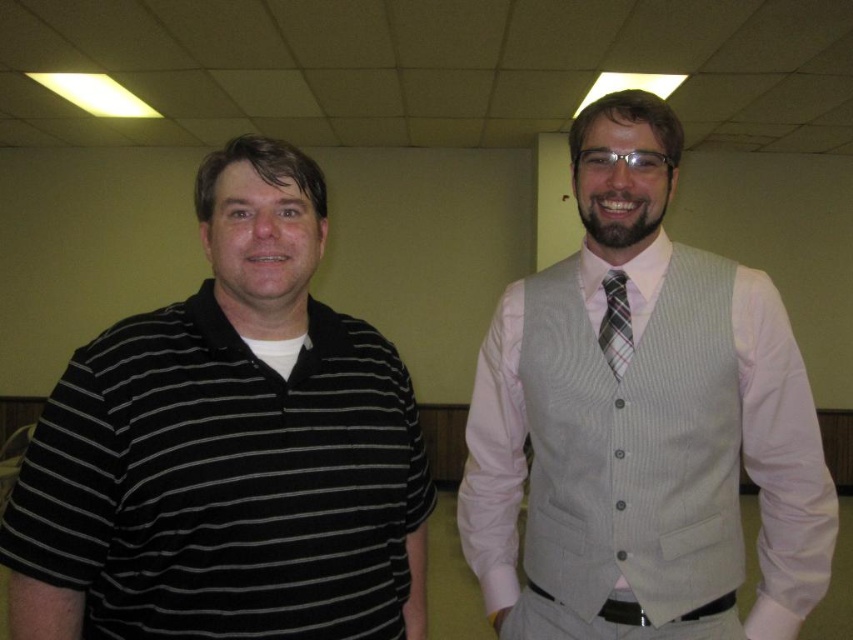
Question: Is light gray textured vest at center bigger than plaid fabric tie at center?

Choices:
 (A) no
 (B) yes

Answer: (B)

Question: Which object is farther from the camera taking this photo?

Choices:
 (A) black striped polo shirt at left
 (B) light gray textured vest at center

Answer: (B)

Question: Which point appears closest to the camera in this image?

Choices:
 (A) (541, 461)
 (B) (605, 308)
 (C) (236, 292)

Answer: (C)

Question: Can you confirm if light gray textured vest at right is thinner than plaid fabric tie at center?

Choices:
 (A) yes
 (B) no

Answer: (B)

Question: Based on their relative distances, which object is farther from the light gray textured vest at right?

Choices:
 (A) black striped polo shirt at left
 (B) plaid fabric tie at center

Answer: (A)

Question: From the image, what is the correct spatial relationship of black striped polo shirt at left in relation to light gray textured vest at center?

Choices:
 (A) above
 (B) below

Answer: (B)